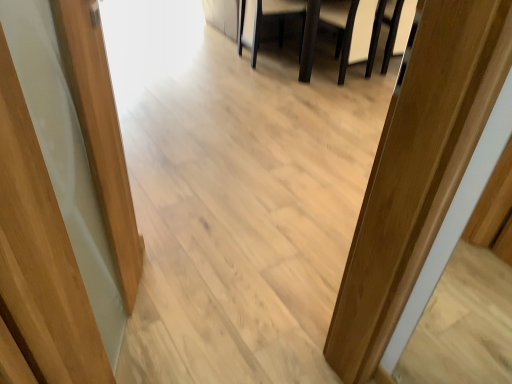
Locate an element on the screen. The image size is (512, 384). vacant region in front of dark brown wooden table at center is located at coordinates (303, 106).